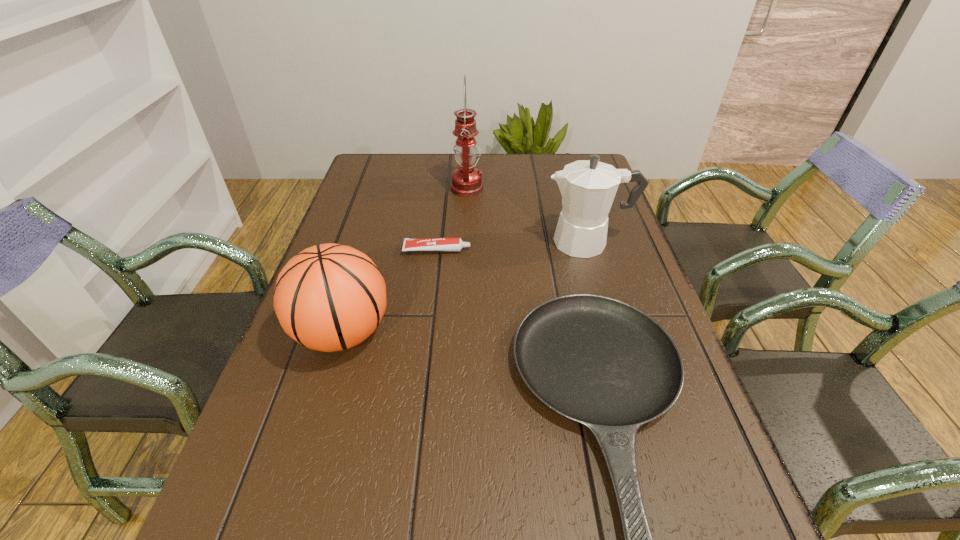
What are the coordinates of `the tallest object` in the screenshot? It's located at (466, 180).

You are a GUI agent. You are given a task and a screenshot of the screen. Output one action in this format:
    pyautogui.click(x=<x>, y=<y>)
    Task: Click on the farthest object
    This screenshot has width=960, height=540.
    Given the screenshot: What is the action you would take?
    pyautogui.click(x=466, y=180)

This screenshot has width=960, height=540. I want to click on coffeepot, so click(x=588, y=187).

Locate an element on the screen. The image size is (960, 540). the third shortest object is located at coordinates (329, 297).

You are a GUI agent. You are given a task and a screenshot of the screen. Output one action in this format:
    pyautogui.click(x=<x>, y=<y>)
    Task: Click on the toothpaste
    This screenshot has width=960, height=540.
    Given the screenshot: What is the action you would take?
    pyautogui.click(x=429, y=244)

Identify the location of vacant space located on the front of the oil lamp. (465, 243).

Where is `free space located 0.250m at the spout of the fourth shortest object`? This screenshot has height=540, width=960. free space located 0.250m at the spout of the fourth shortest object is located at coordinates (451, 242).

Image resolution: width=960 pixels, height=540 pixels. What are the coordinates of `free spot located 0.080m at the spout of the fourth shortest object` in the screenshot? It's located at (514, 242).

Locate an element on the screen. This screenshot has height=540, width=960. free space located 0.330m at the spout of the fourth shortest object is located at coordinates (421, 242).

Where is `vacant region located 0.300m on the back of the third tallest object`? vacant region located 0.300m on the back of the third tallest object is located at coordinates (375, 224).